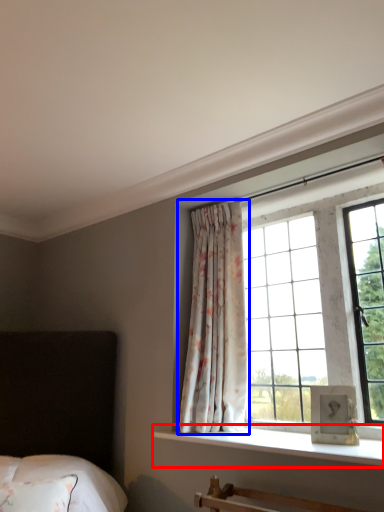
Question: Among these objects, which one is nearest to the camera, window sill (highlighted by a red box) or curtain (highlighted by a blue box)?

Choices:
 (A) window sill
 (B) curtain

Answer: (A)